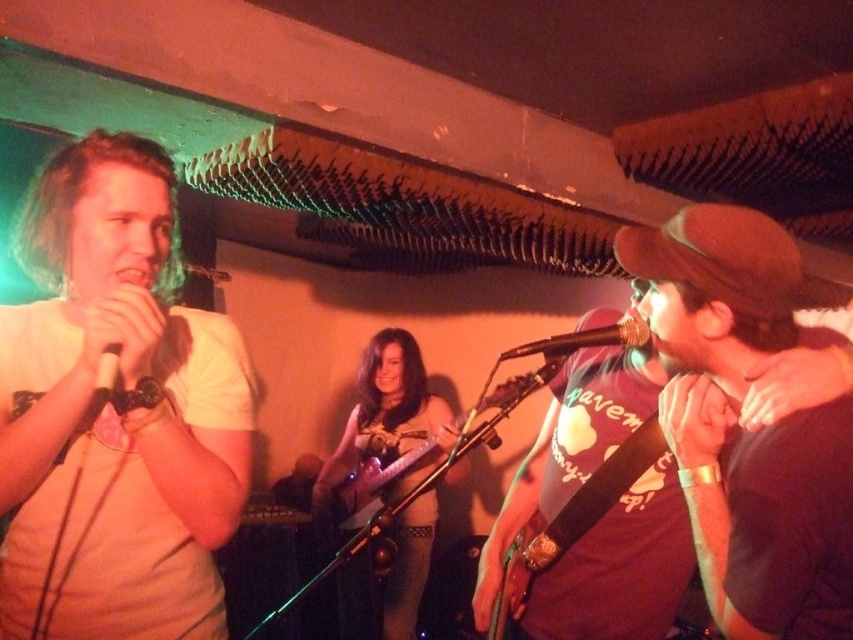
Between brown fabric cap at upper right and wooden acoustic guitar at center, which one has more height?

Standing taller between the two is brown fabric cap at upper right.

Is point (488, 588) closer to camera compared to point (432, 445)?

Yes, point (488, 588) is in front of point (432, 445).

Between point (637, 576) and point (355, 483), which one is positioned behind?

Positioned behind is point (355, 483).

At what (x,y) coordinates should I click in order to perform the action: click on brown fabric cap at upper right. Please return your answer as a coordinate pair (x, y). This screenshot has height=640, width=853. Looking at the image, I should click on (665, 355).

Is point (438, 412) positioned before point (363, 496)?

No, it is not.

Image resolution: width=853 pixels, height=640 pixels. I want to click on leather-like brown guitar at center, so click(x=386, y=420).

You are a GUI agent. You are given a task and a screenshot of the screen. Output one action in this format:
    pyautogui.click(x=<x>, y=<y>)
    Task: Click on the leather-like brown guitar at center
    This screenshot has height=640, width=853.
    Given the screenshot: What is the action you would take?
    pyautogui.click(x=386, y=420)

Where is `leather-like brown guitar at center`? leather-like brown guitar at center is located at coordinates (386, 420).

Who is more forward, (418, 355) or (624, 346)?

Point (624, 346) is more forward.

At what (x,y) coordinates should I click in order to perform the action: click on leather-like brown guitar at center. Please return your answer as a coordinate pair (x, y). Looking at the image, I should click on (386, 420).